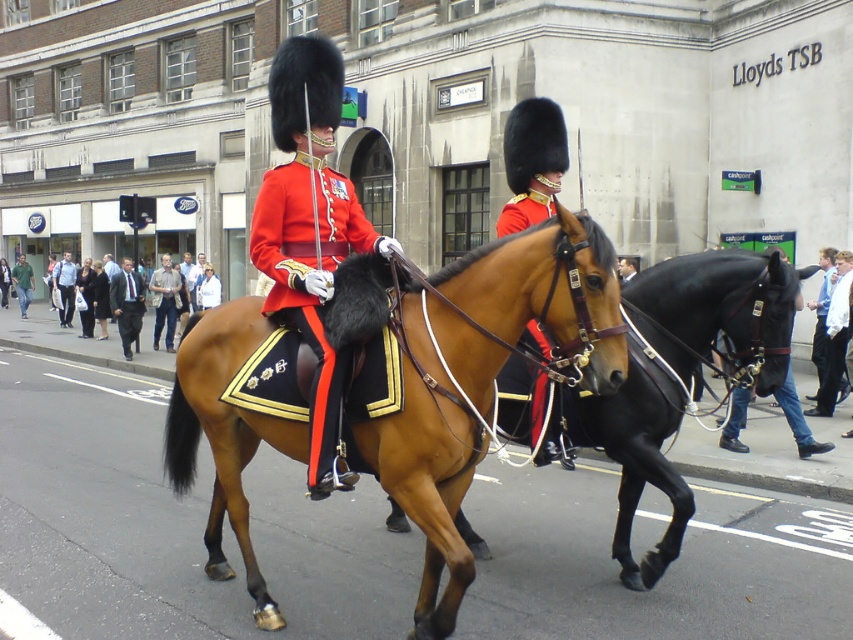
Question: Which point appears closest to the camera in this image?

Choices:
 (A) (74, 285)
 (B) (660, 380)

Answer: (B)

Question: Is dark suit at left positioned behind light blue shirt at center?

Choices:
 (A) no
 (B) yes

Answer: (A)

Question: Can you confirm if shiny red fabric at center is positioned to the left of satin gold helmet at center?

Choices:
 (A) no
 (B) yes

Answer: (B)

Question: Which point is closer to the camera?

Choices:
 (A) (25, 314)
 (B) (822, 333)
 (C) (651, 397)

Answer: (C)

Question: Which point is farther to the camera?

Choices:
 (A) (68, 262)
 (B) (165, 314)
 (C) (338, 369)
 (D) (544, 376)

Answer: (A)

Question: Can you confirm if dark suit at left is positioned above blue shirt at center?

Choices:
 (A) yes
 (B) no

Answer: (A)